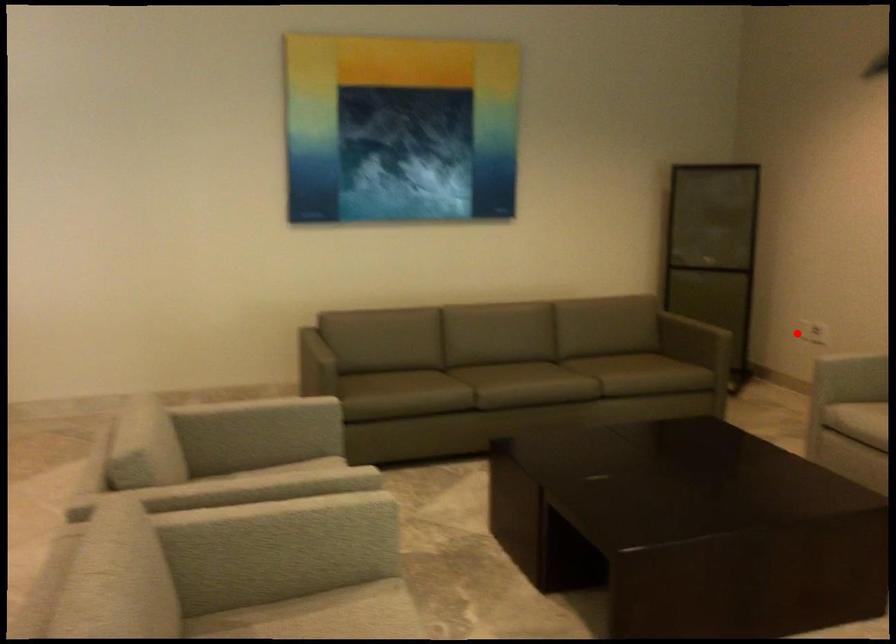
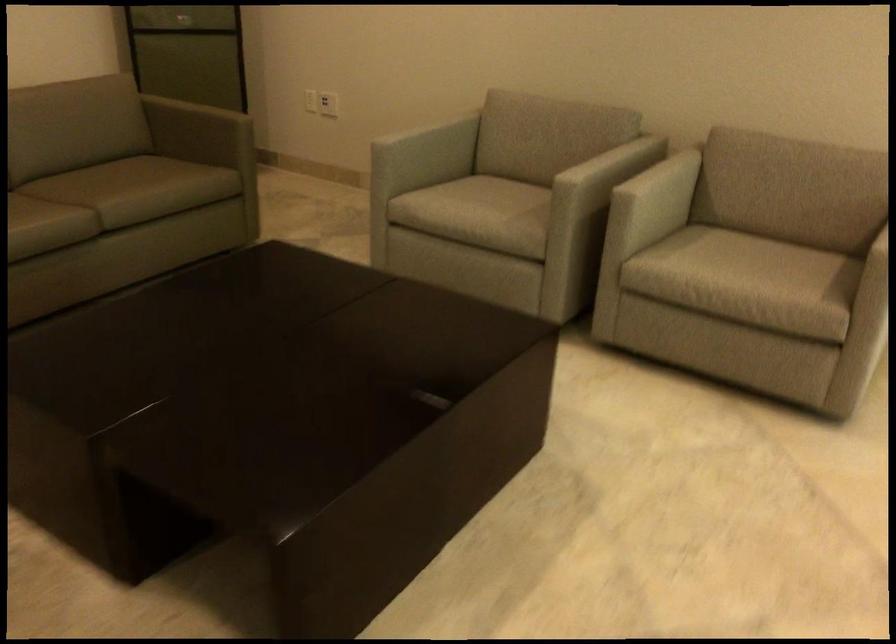
Question: I am providing you with two images of the same scene from different viewpoints. Image1 has a red point marked. In image2, the corresponding 3D location appears at what relative position? Reply with the corresponding letter.

Choices:
 (A) Closer
 (B) Farther

Answer: (A)